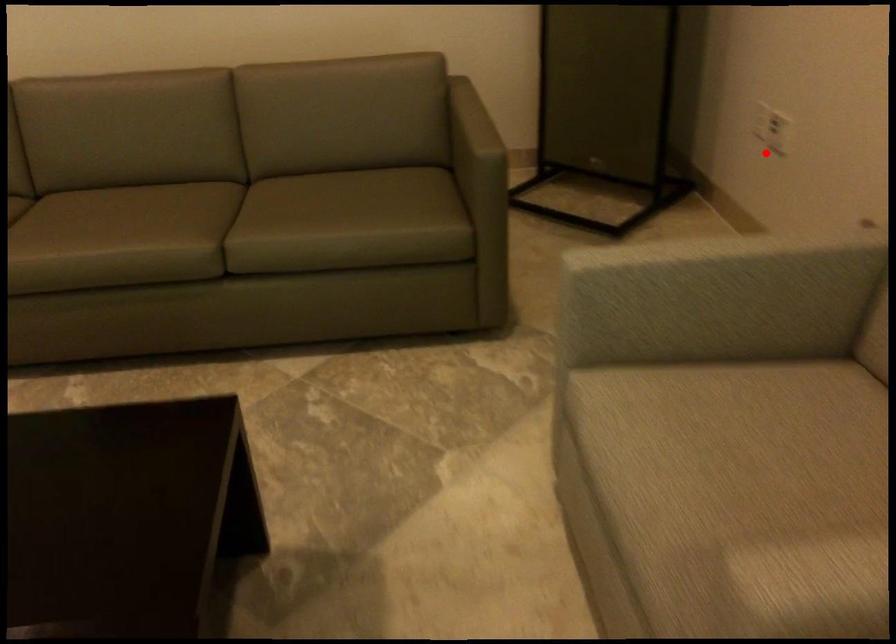
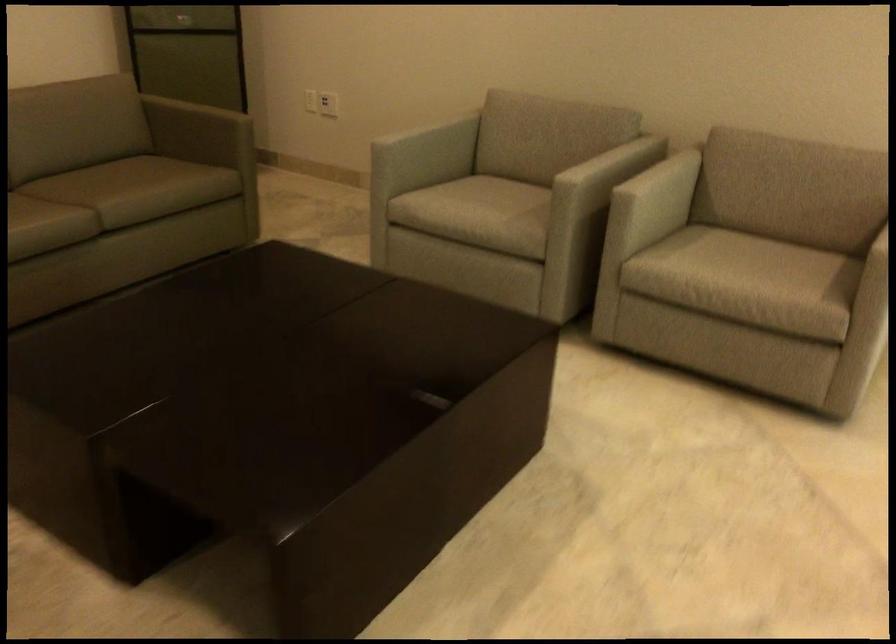
Question: I am providing you with two images of the same scene from different viewpoints. In image1, a red point is highlighted. Considering the same 3D point in image2, which of the following is correct?

Choices:
 (A) It is closer
 (B) It is farther

Answer: (B)